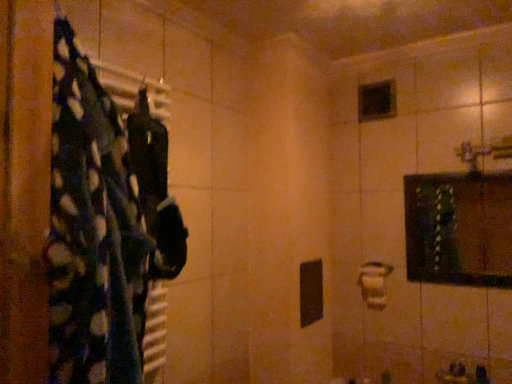
Question: Is dark green fabric at left to the left or to the right of wooden framed mirror at upper right in the image?

Choices:
 (A) right
 (B) left

Answer: (B)

Question: Is dark green fabric at left inside the boundaries of wooden framed mirror at upper right, or outside?

Choices:
 (A) inside
 (B) outside

Answer: (B)

Question: Estimate the real-world distances between objects in this image. Which object is farther from the wooden framed mirror at upper right?

Choices:
 (A) white matte toilet paper at center-right
 (B) black glass mirror at upper center
 (C) dark green fabric at left
 (D) black fabric at left

Answer: (C)

Question: Estimate the real-world distances between objects in this image. Which object is closer to the black glass mirror at upper center?

Choices:
 (A) wooden framed mirror at upper right
 (B) white matte toilet paper at center-right
 (C) dark green fabric at left
 (D) black fabric at left

Answer: (B)